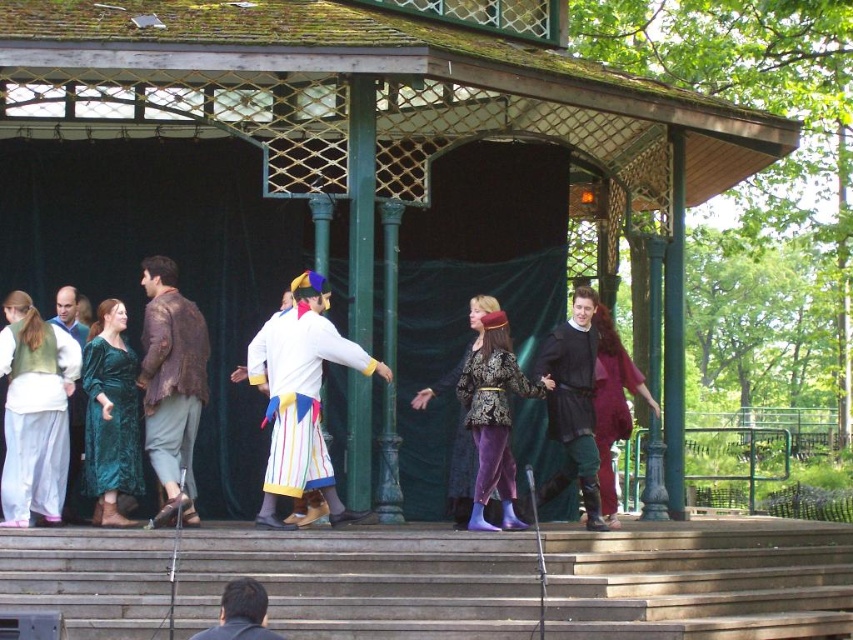
Is dark brown leather boots at center to the right of velvet maroon dress at center from the viewer's perspective?

No, dark brown leather boots at center is not to the right of velvet maroon dress at center.

Does point (549, 412) come closer to viewer compared to point (614, 397)?

Yes, point (549, 412) is in front of point (614, 397).

Locate an element on the screen. Image resolution: width=853 pixels, height=640 pixels. dark brown leather boots at center is located at coordinates (573, 403).

Between wooden stairs at center and brown textured jacket at center, which one appears on the right side from the viewer's perspective?

wooden stairs at center

Can you confirm if wooden stairs at center is bigger than brown textured jacket at center?

Yes, wooden stairs at center is bigger than brown textured jacket at center.

Is point (801, 541) behind point (175, 492)?

That is True.

This screenshot has width=853, height=640. In order to click on wooden stairs at center in this screenshot , I will do `click(367, 580)`.

Between dark brown leather boots at center and dark brown leather jacket at lower center, which one is positioned lower?

dark brown leather jacket at lower center

Between dark brown leather boots at center and dark brown leather jacket at lower center, which one appears on the right side from the viewer's perspective?

→ From the viewer's perspective, dark brown leather boots at center appears more on the right side.

Between point (587, 368) and point (223, 600), which one is positioned behind?

Positioned behind is point (587, 368).

The height and width of the screenshot is (640, 853). I want to click on dark brown leather boots at center, so click(x=573, y=403).